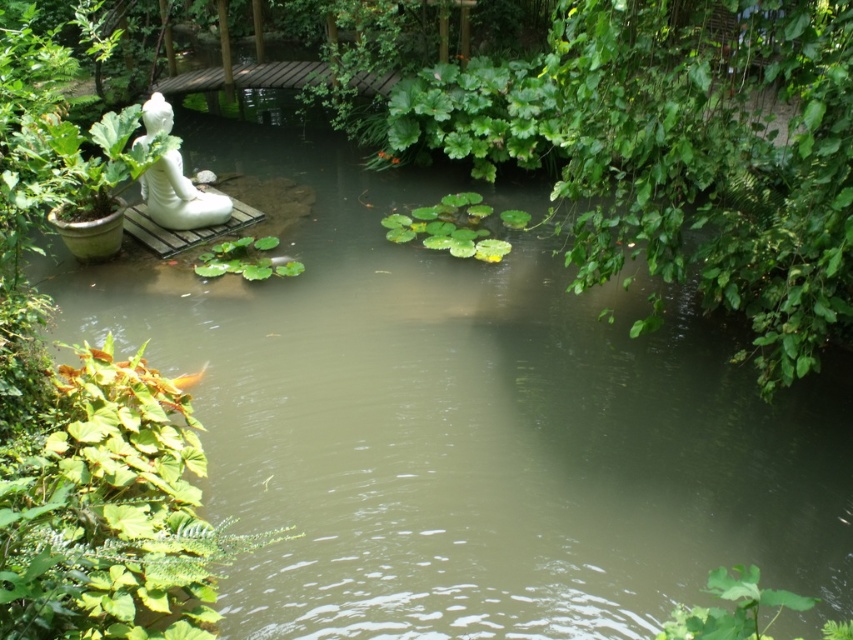
You are standing in the garden and want to water both the green leafy plant at lower left and the green leafy plant at center. Which plant should you water first if you want to start with the one nearest to you?

You should water the green leafy plant at lower left first because it is closer to the viewer than the green leafy plant at center.

You are standing at the center of the garden looking towards the wooden platform with the statue. Which direction should you move to find the green leafy plant at lower left?

The green leafy plant at lower left is located at point (x=109, y=512), so you should move towards the lower left direction to find it.

You are standing in the garden and want to take a photo of the green leafy plant at lower left and the white glossy statue at upper left. Which object will appear larger in the photo?

The green leafy plant at lower left will appear larger in the photo because it is closer to the viewer than the white glossy statue at upper left.